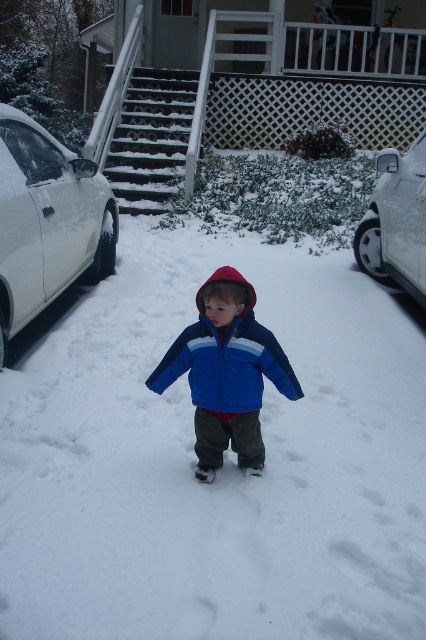
How distant is white glossy car at left from blue fleece jacket at center?

7.21 feet

Does white glossy car at left appear on the right side of blue fleece jacket at center?

In fact, white glossy car at left is to the left of blue fleece jacket at center.

Which is behind, point (97, 164) or point (238, 301)?

The point (97, 164) is more distant.

The width and height of the screenshot is (426, 640). I want to click on white glossy car at left, so click(x=48, y=221).

Who is positioned more to the right, white glossy car at left or white glossy car at right?

From the viewer's perspective, white glossy car at right appears more on the right side.

Between point (86, 212) and point (423, 248), which one is positioned in front?

Point (423, 248) is in front.

The height and width of the screenshot is (640, 426). Find the location of `white glossy car at left`. white glossy car at left is located at coordinates (48, 221).

Who is higher up, blue fleece jacket at center or white glossy car at right?

white glossy car at right

Who is positioned more to the right, blue fleece jacket at center or white glossy car at right?

Positioned to the right is white glossy car at right.

This screenshot has height=640, width=426. Describe the element at coordinates (227, 372) in the screenshot. I see `blue fleece jacket at center` at that location.

Find the location of a particular element. The height and width of the screenshot is (640, 426). blue fleece jacket at center is located at coordinates (227, 372).